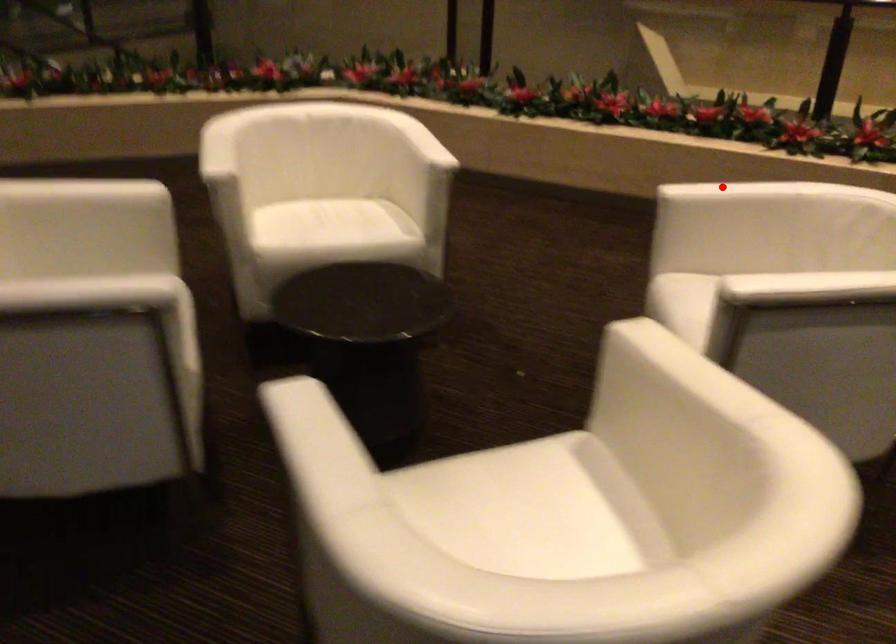
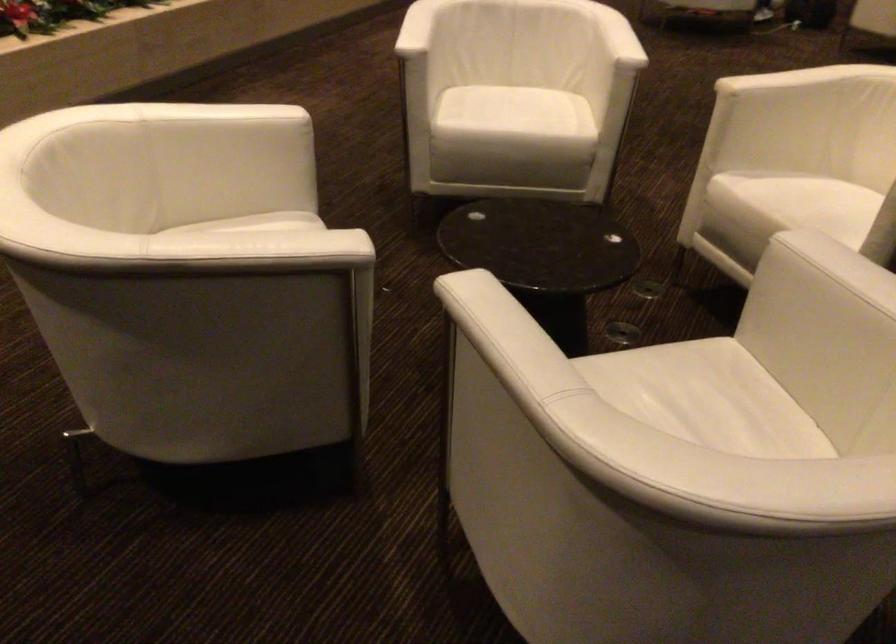
Locate, in the second image, the point that corresponds to the highlighted location in the first image.

(417, 28)